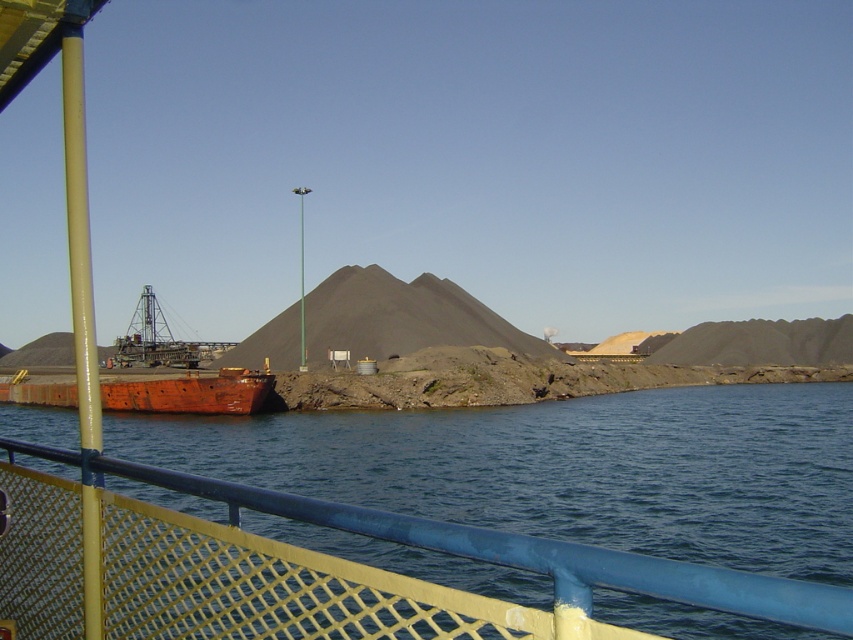
You are standing at the edge of the waterfront scene. There is blue water at lower center in front of you. Can you safely step into the water without falling into deeper water immediately?

The blue water at lower center is only 1.38 meters away from you, so stepping into it might be possible, but caution is advised as the depth isn not specified.

You are a delivery boat captain approaching the dock. You need to navigate between the blue water at lower center and the rusty metal boat at lower left. Which one is wider so you can choose the best route?

The blue water at lower center is wider than the rusty metal boat at lower left, so you should choose the route through the blue water at lower center for better navigation.